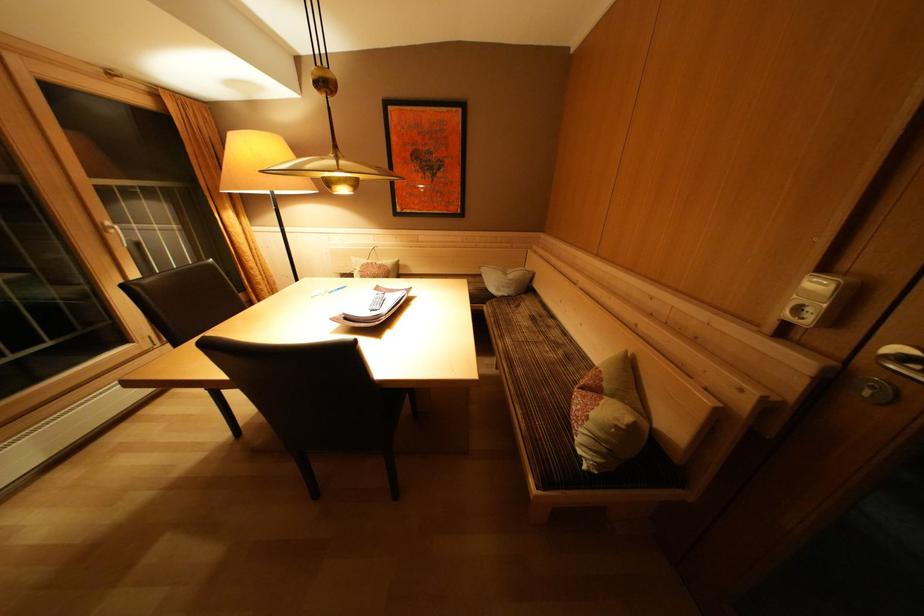
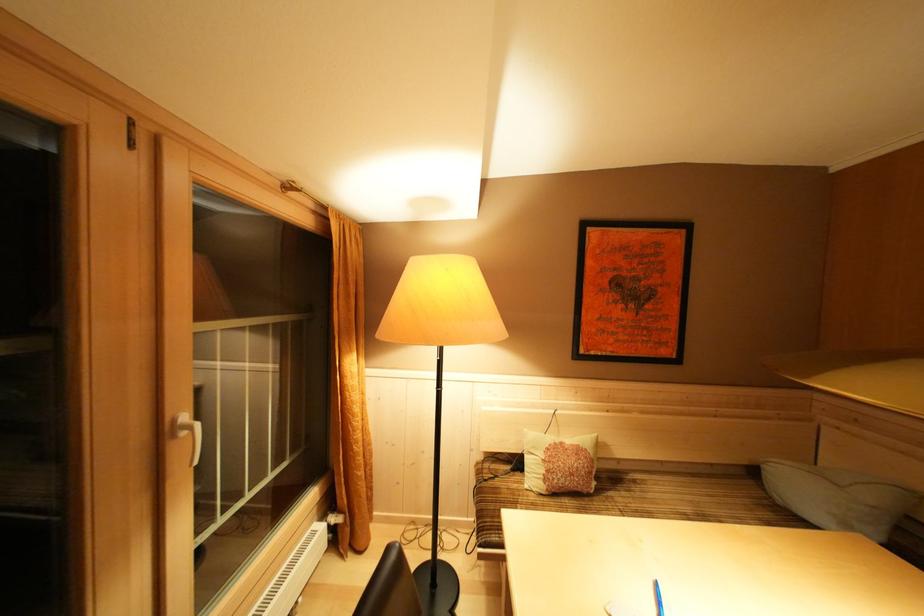
Where in the second image is the point corresponding to point 379,268 from the first image?

(568, 448)